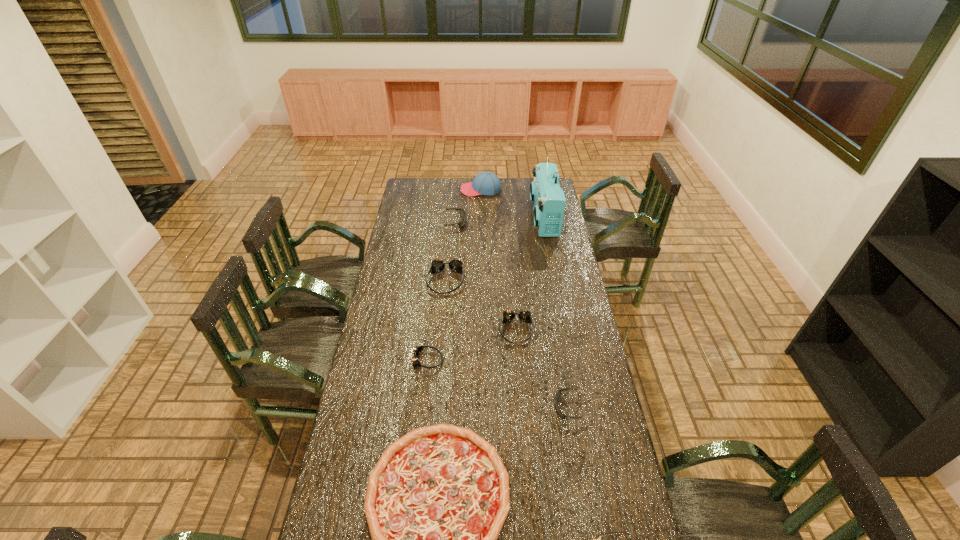
Select which object is the eighth closest to the second biggest bronze goggles. Please provide its 2D coordinates. Your answer should be formatted as a tuple, i.e. [(x, y)], where the tuple contains the x and y coordinates of a point satisfying the conditions above.

[(487, 183)]

The width and height of the screenshot is (960, 540). In order to click on goggles that is the sixth closest to the pizza in this screenshot , I will do `click(462, 213)`.

Where is `the closest goggles to the bigger black goggles`? This screenshot has height=540, width=960. the closest goggles to the bigger black goggles is located at coordinates (455, 264).

In order to click on the third closest bronze goggles to the farthest object in this screenshot , I will do `click(417, 349)`.

Where is `bronze goggles that stands as the closest to the second nearest goggles`? The image size is (960, 540). bronze goggles that stands as the closest to the second nearest goggles is located at coordinates (524, 315).

The height and width of the screenshot is (540, 960). Find the location of `free space that satisfies the following two spatial constraints: 1. through the lenses of the fourth goggles from left to right; 2. through the lenses of the third nearest goggles`. free space that satisfies the following two spatial constraints: 1. through the lenses of the fourth goggles from left to right; 2. through the lenses of the third nearest goggles is located at coordinates (518, 360).